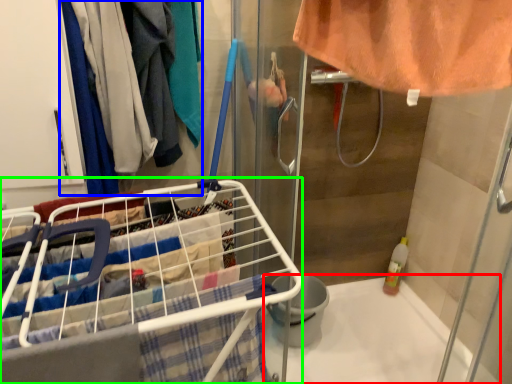
Question: Which object is positioned farthest from bath (highlighted by a red box)? Select from clothing (highlighted by a blue box) and shopping cart (highlighted by a green box).

Choices:
 (A) clothing
 (B) shopping cart

Answer: (A)